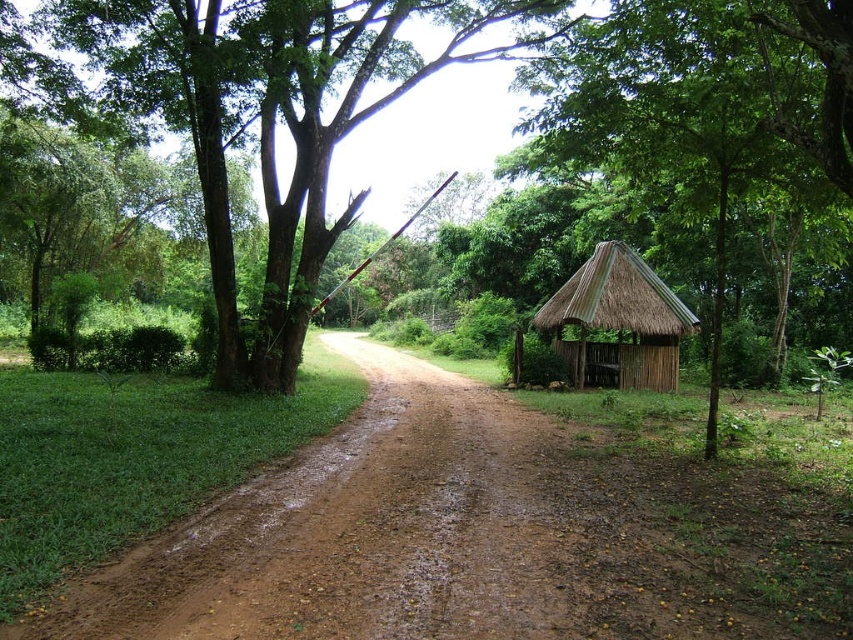
You are standing at the large tree with a thick trunk on the left side of the dirt path. You want to walk to the small hut with a thatched roof on the right side of the path. Which point, point (665,524) or point (583,285), is closer to you as you start your journey?

Point (665,524) is closer to you than point (583,285) because it is nearer to the large tree where you are starting your journey.

You are a gardener with a wheelbarrow that is 1.2 meters wide. You need to transport soil along the brown dirt track at center while avoiding the green thatch hut at right. Can your wheelbarrow fit through the track without hitting the hut?

The brown dirt track at center is wider than the green thatch hut at right, so the wheelbarrow can fit through the track as long as it stays centered and avoids the hut.

You are a traveler walking along the dirt path and need to decide which direction to go. You notice the green thatch hut at right and the thatched bamboo hut at right. Which of these two huts is located to the left when facing the path?

The green thatch hut at right is positioned on the left side of thatched bamboo hut at right, so when facing the path, the green thatch hut at right is to the left of the thatched bamboo hut at right.